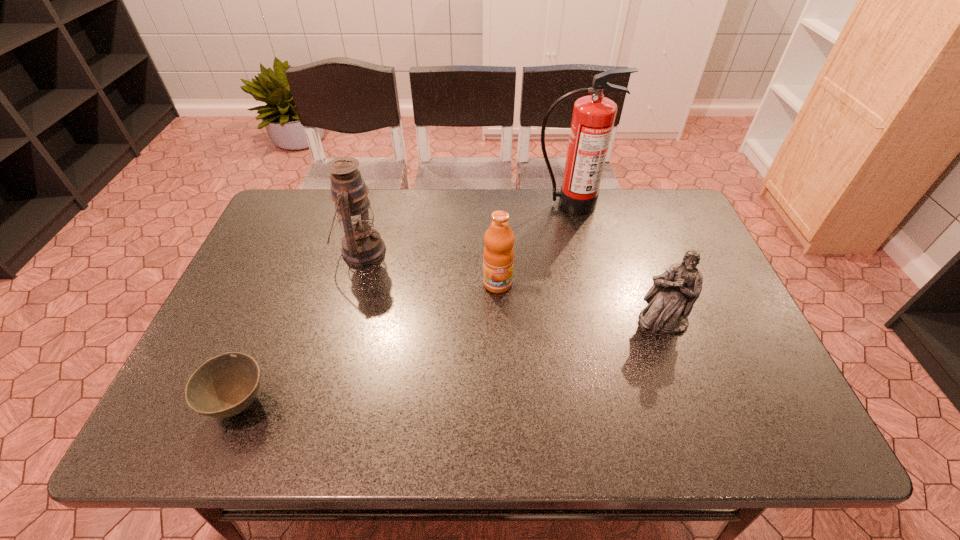
The height and width of the screenshot is (540, 960). Find the location of `vacant space located on the label side of the third object from right to left`. vacant space located on the label side of the third object from right to left is located at coordinates (503, 429).

Locate an element on the screen. vacant region located 0.180m on the front-facing side of the figurine is located at coordinates (692, 404).

Where is `blank space located on the left of the bowl`? The image size is (960, 540). blank space located on the left of the bowl is located at coordinates (179, 403).

The image size is (960, 540). In order to click on fire extinguisher located in the far edge section of the desktop in this screenshot , I will do `click(593, 118)`.

The image size is (960, 540). Find the location of `oil lamp at the far edge`. oil lamp at the far edge is located at coordinates (361, 245).

Identify the location of object situated at the near edge. (225, 385).

I want to click on object that is positioned at the left edge, so click(x=225, y=385).

Identify the location of object at the right edge. Image resolution: width=960 pixels, height=540 pixels. (670, 300).

The image size is (960, 540). What are the coordinates of `object that is at the near left corner` in the screenshot? It's located at (225, 385).

Identify the location of free space at the far edge. The height and width of the screenshot is (540, 960). (514, 192).